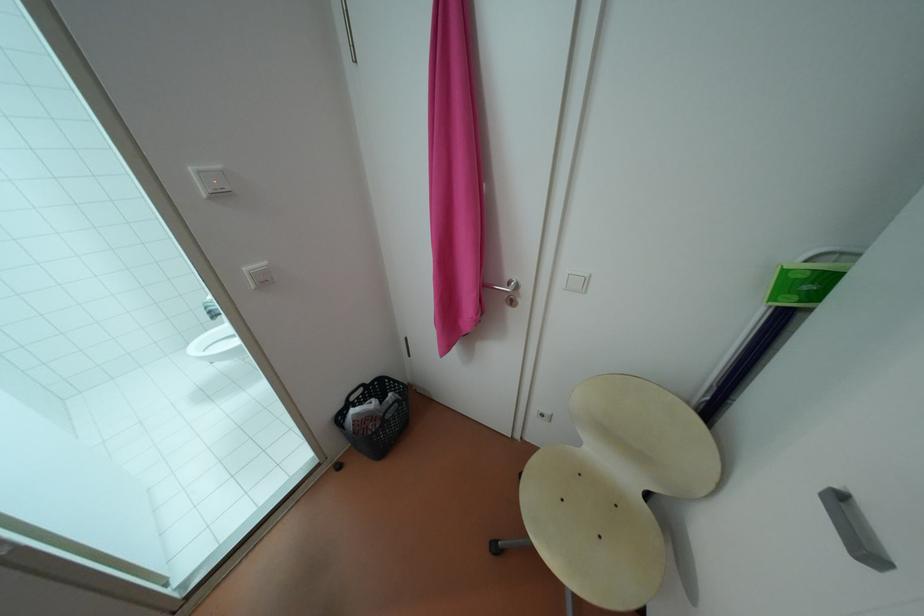
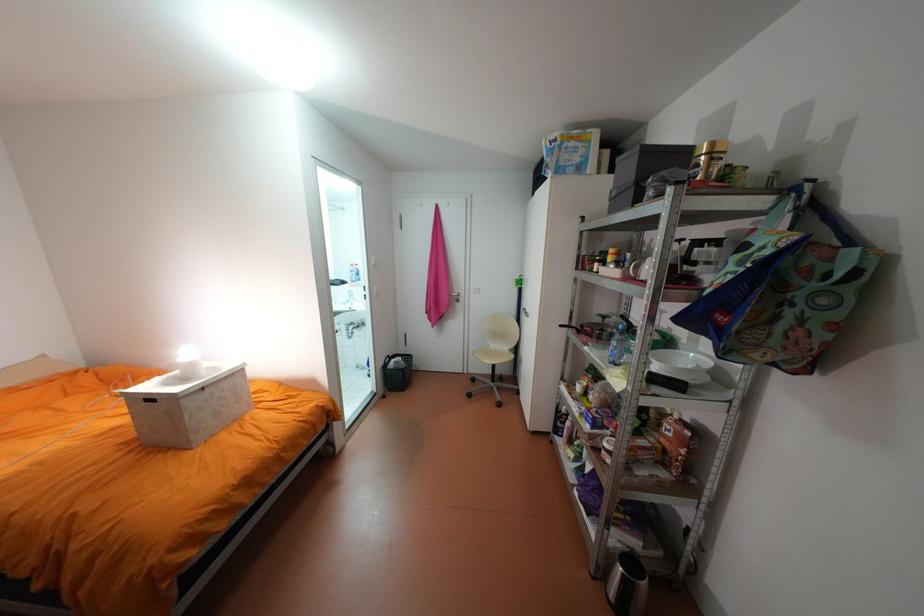
The point at (360,410) is marked in the first image. Where is the corresponding point in the second image?

(402, 360)